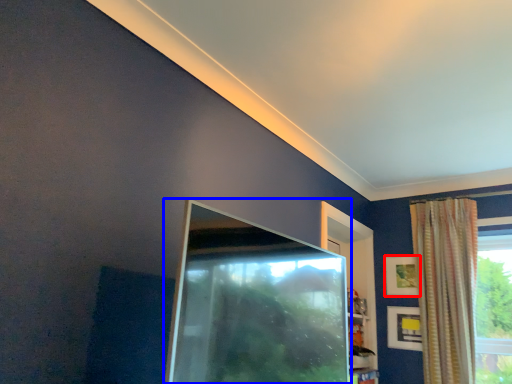
Question: Which object appears closest to the camera in this image, picture frame (highlighted by a red box) or screen door (highlighted by a blue box)?

Choices:
 (A) picture frame
 (B) screen door

Answer: (B)